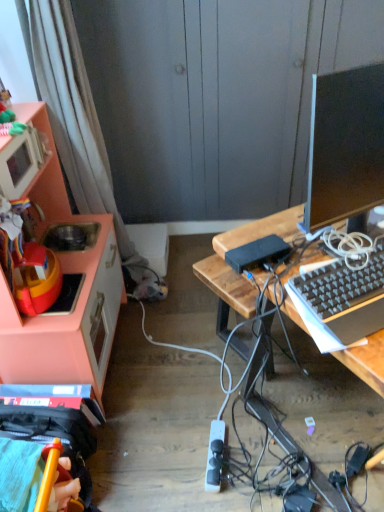
Question: Does pink matte cabinet at left have a larger size compared to white plastic power outlet at lower center?

Choices:
 (A) no
 (B) yes

Answer: (B)

Question: Are pink matte cabinet at left and white plastic power outlet at lower center far apart?

Choices:
 (A) yes
 (B) no

Answer: (B)

Question: From a real-world perspective, is pink matte cabinet at left located higher than white plastic power outlet at lower center?

Choices:
 (A) yes
 (B) no

Answer: (A)

Question: Is pink matte cabinet at left thinner than white plastic power outlet at lower center?

Choices:
 (A) no
 (B) yes

Answer: (A)

Question: Is pink matte cabinet at left positioned in front of white plastic power outlet at lower center?

Choices:
 (A) no
 (B) yes

Answer: (B)

Question: Does pink matte cabinet at left have a lesser height compared to white plastic power outlet at lower center?

Choices:
 (A) yes
 (B) no

Answer: (B)

Question: Does black glossy monitor at right come behind white plastic power outlet at lower center?

Choices:
 (A) no
 (B) yes

Answer: (A)

Question: Could you tell me if black glossy monitor at right is turned towards white plastic power outlet at lower center?

Choices:
 (A) yes
 (B) no

Answer: (B)

Question: Is black glossy monitor at right taller than white plastic power outlet at lower center?

Choices:
 (A) yes
 (B) no

Answer: (A)

Question: From the image's perspective, would you say black glossy monitor at right is positioned over white plastic power outlet at lower center?

Choices:
 (A) no
 (B) yes

Answer: (B)

Question: Is white plastic power outlet at lower center inside black glossy monitor at right?

Choices:
 (A) yes
 (B) no

Answer: (B)

Question: From a real-world perspective, is black glossy monitor at right physically above white plastic power outlet at lower center?

Choices:
 (A) no
 (B) yes

Answer: (B)

Question: Is black plastic keyboard at right at the left side of white plastic power outlet at lower center?

Choices:
 (A) no
 (B) yes

Answer: (A)